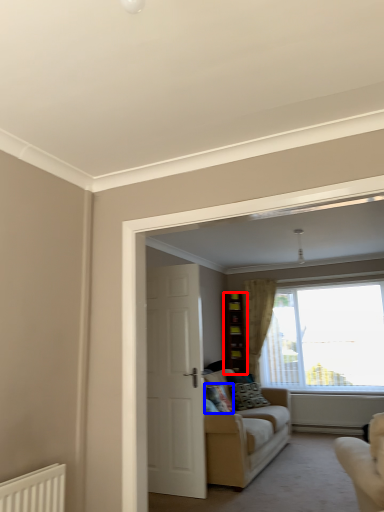
Question: Which object appears closest to the camera in this image, cabinetry (highlighted by a red box) or pillow (highlighted by a blue box)?

Choices:
 (A) cabinetry
 (B) pillow

Answer: (B)